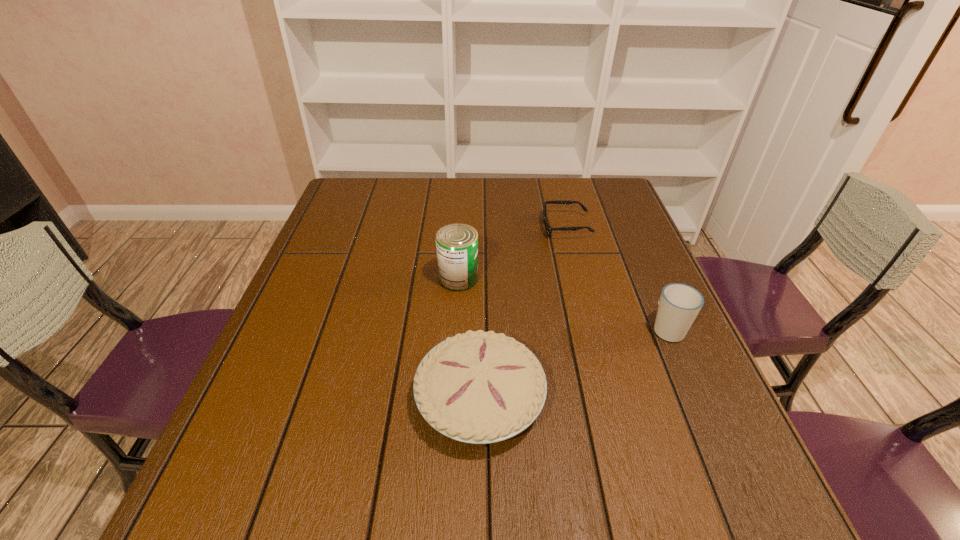
Where is `vacant space located with a handle on the side of the third farthest object`? vacant space located with a handle on the side of the third farthest object is located at coordinates (629, 239).

Identify the location of vacant space located 0.130m with a handle on the side of the third farthest object. (645, 276).

The width and height of the screenshot is (960, 540). What are the coordinates of `vacant space located 0.170m on the left of the pie` in the screenshot? It's located at (327, 398).

Find the location of a particular element. This screenshot has height=540, width=960. vacant space positioned on the front-facing side of the shortest object is located at coordinates (490, 227).

Image resolution: width=960 pixels, height=540 pixels. In order to click on free space located 0.180m on the front-facing side of the shortest object in this screenshot , I will do `click(480, 227)`.

You are a GUI agent. You are given a task and a screenshot of the screen. Output one action in this format:
    pyautogui.click(x=<x>, y=<y>)
    Task: Click on the free region located 0.060m on the front-facing side of the shortest object
    Image resolution: width=960 pixels, height=540 pixels.
    Given the screenshot: What is the action you would take?
    pyautogui.click(x=521, y=227)

This screenshot has height=540, width=960. I want to click on object located at the far edge, so click(549, 229).

Image resolution: width=960 pixels, height=540 pixels. In order to click on cup that is at the right edge in this screenshot , I will do `click(679, 304)`.

Image resolution: width=960 pixels, height=540 pixels. In order to click on sunglasses present at the right edge in this screenshot , I will do `click(549, 229)`.

In order to click on object that is positioned at the far right corner in this screenshot , I will do `click(549, 229)`.